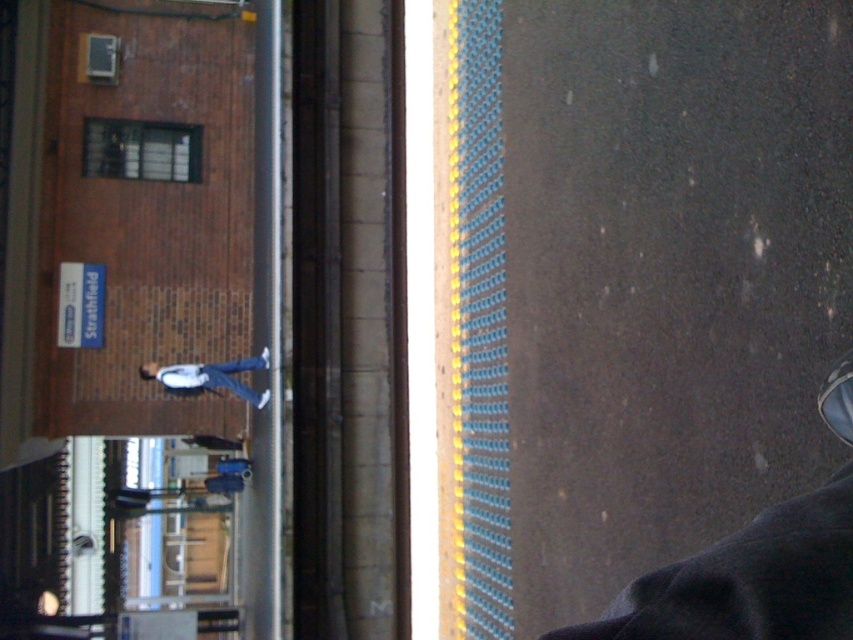
You are standing on the platform at the Strathfield station and want to reach the brick textured window at upper left. Given that the average walking speed is 3 feet per second, how many seconds will it take you to reach it?

The brick textured window at upper left is 69.90 feet away. At 3 feet per second, dividing 69.90 by 3 gives approximately 23.3 seconds to reach it.

You are a maintenance worker at the station and need to reach the brick textured window at upper left from the light blue jeans at center. Can you walk directly to it without moving around any obstacles?

The brick textured window at upper left and light blue jeans at center are 3.03 meters apart from each other. Since there are no obstacles mentioned in the scene description between them, you can walk directly to the brick textured window at upper left from the light blue jeans at center.

You are a visually impaired person trying to navigate the platform. You notice the brick textured window at upper left and the light blue jeans at center. Which object takes up more space in the image?

The light blue jeans at center takes up more space than the brick textured window at upper left because the brick textured window at upper left occupies less space than light blue jeans at center.